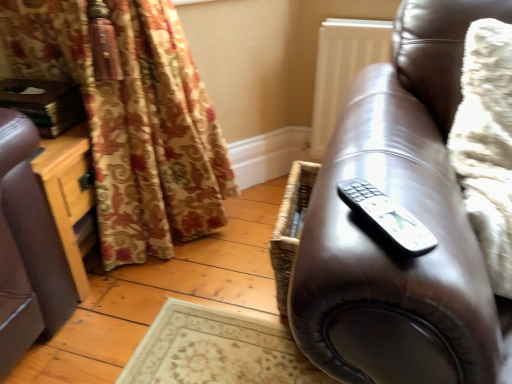
Question: In terms of height, does white plastic remote at right look taller or shorter compared to matte brown leather couch at right?

Choices:
 (A) tall
 (B) short

Answer: (B)

Question: Considering the positions of point (373, 195) and point (373, 168), is point (373, 195) closer or farther from the camera than point (373, 168)?

Choices:
 (A) farther
 (B) closer

Answer: (B)

Question: Relative to matte brown leather couch at right, is white plastic remote at right in front or behind?

Choices:
 (A) front
 (B) behind

Answer: (B)

Question: From a real-world perspective, is matte brown leather couch at right above or below white plastic remote at right?

Choices:
 (A) above
 (B) below

Answer: (B)

Question: From the image's perspective, is matte brown leather couch at right located above or below white plastic remote at right?

Choices:
 (A) above
 (B) below

Answer: (B)

Question: Does point (419, 281) appear closer or farther from the camera than point (378, 211)?

Choices:
 (A) closer
 (B) farther

Answer: (A)

Question: Looking at the image, does matte brown leather couch at right seem bigger or smaller compared to white plastic remote at right?

Choices:
 (A) big
 (B) small

Answer: (A)